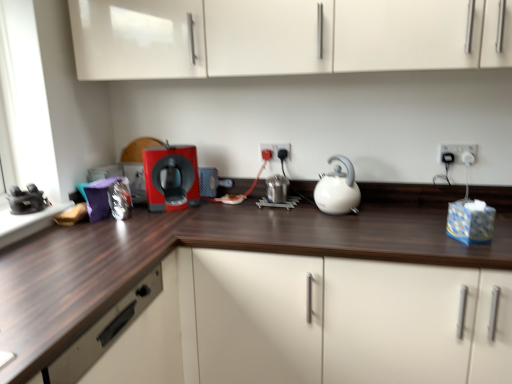
At what (x,y) coordinates should I click in order to perform the action: click on wooden drawer at lower left. Please return your answer as a coordinate pair (x, y). Looking at the image, I should click on (104, 332).

What do you see at coordinates (277, 149) in the screenshot?
I see `matte plastic plug at center, arranged as the first electric outlet when viewed from the left` at bounding box center [277, 149].

This screenshot has height=384, width=512. Find the location of `white glossy kettle at center`. white glossy kettle at center is located at coordinates (338, 189).

At what (x,y) coordinates should I click in order to perform the action: click on matte plastic coffee machine at center. Please return your answer as a coordinate pair (x, y). This screenshot has height=384, width=512. Looking at the image, I should click on (170, 177).

From a real-world perspective, is dark wood countertop at center above or below matte plastic plug at center, the 1th electric outlet in the back-to-front sequence?

In terms of real-world spatial position, dark wood countertop at center is below matte plastic plug at center, the 1th electric outlet in the back-to-front sequence.

Does dark wood countertop at center come in front of matte plastic plug at center, arranged as the first electric outlet when viewed from the left?

Yes, dark wood countertop at center is in front of matte plastic plug at center, arranged as the first electric outlet when viewed from the left.

Between dark wood countertop at center and matte plastic plug at center, the second electric outlet in the right-to-left sequence, which one has more height?

dark wood countertop at center is taller.

Would you say dark wood countertop at center is to the left or to the right of matte plastic plug at center, the 1th electric outlet in the back-to-front sequence, in the picture?

From the image, it's evident that dark wood countertop at center is to the right of matte plastic plug at center, the 1th electric outlet in the back-to-front sequence.

From a real-world perspective, between white glossy kettle at center and matte plastic plug at center, the 1th electric outlet in the back-to-front sequence, who is vertically lower?

white glossy kettle at center is physically lower.

Considering the relative sizes of white glossy kettle at center and matte plastic plug at center, the second electric outlet in the right-to-left sequence, in the image provided, is white glossy kettle at center smaller than matte plastic plug at center, the second electric outlet in the right-to-left sequence,?

No.

Can you see white glossy kettle at center touching matte plastic plug at center, arranged as the second electric outlet when viewed from the front?

white glossy kettle at center is not next to matte plastic plug at center, arranged as the second electric outlet when viewed from the front, and they're not touching.

How different are the orientations of matte plastic plug at center, the 1th electric outlet in the back-to-front sequence, and matte plastic coffee machine at center in degrees?

matte plastic plug at center, the 1th electric outlet in the back-to-front sequence, and matte plastic coffee machine at center are facing 37.7 degrees away from each other.

Is matte plastic coffee machine at center completely or partially inside matte plastic plug at center, arranged as the second electric outlet when viewed from the front?

No, matte plastic plug at center, arranged as the second electric outlet when viewed from the front, does not contain matte plastic coffee machine at center.

Is point (278, 159) positioned before point (168, 209)?

No.

I want to click on home appliance that appears on the left of matte plastic plug at center, the 1th electric outlet in the back-to-front sequence, so click(x=170, y=177).

Is wooden drawer at lower left outside of white glossy kettle at center?

That's correct, wooden drawer at lower left is outside of white glossy kettle at center.

Is wooden drawer at lower left wider than white glossy kettle at center?

Indeed, wooden drawer at lower left has a greater width compared to white glossy kettle at center.

Is wooden drawer at lower left looking in the opposite direction of white glossy kettle at center?

No, wooden drawer at lower left is not facing the opposite direction of white glossy kettle at center.

In the image, is wooden drawer at lower left positioned in front of or behind white glossy kettle at center?

In the image, wooden drawer at lower left appears in front of white glossy kettle at center.

Would you say dark wood countertop at center is inside or outside white plastic electric outlet at upper right, the first electric outlet from the right?

dark wood countertop at center is not inside white plastic electric outlet at upper right, the first electric outlet from the right, it's outside.

From a real-world perspective, which object rests below the other?

dark wood countertop at center.

Considering the relative sizes of dark wood countertop at center and white plastic electric outlet at upper right, the first electric outlet from the right, in the image provided, is dark wood countertop at center bigger than white plastic electric outlet at upper right, the first electric outlet from the right,?

Yes.

Is point (15, 310) positioned behind point (467, 145)?

No.

Between point (450, 152) and point (71, 363), which one is positioned in front?

The point (71, 363) is closer to the camera.

Between white plastic electric outlet at upper right, which is the second electric outlet in left-to-right order, and wooden drawer at lower left, which one has smaller size?

white plastic electric outlet at upper right, which is the second electric outlet in left-to-right order.

From a real-world perspective, is white plastic electric outlet at upper right, which is the second electric outlet in left-to-right order, on top of wooden drawer at lower left?

Correct, in the physical world, white plastic electric outlet at upper right, which is the second electric outlet in left-to-right order, is higher than wooden drawer at lower left.

How many degrees apart are the facing directions of white plastic electric outlet at upper right, placed as the first electric outlet when sorted from front to back, and wooden drawer at lower left?

They differ by 91.2 degrees in their facing directions.

Is the surface of dark wood countertop at center in direct contact with wooden drawer at lower left?

dark wood countertop at center and wooden drawer at lower left are clearly separated.

From a real-world perspective, who is located lower, dark wood countertop at center or wooden drawer at lower left?

dark wood countertop at center.

Considering the relative sizes of dark wood countertop at center and wooden drawer at lower left in the image provided, is dark wood countertop at center shorter than wooden drawer at lower left?

In fact, dark wood countertop at center may be taller than wooden drawer at lower left.

Is dark wood countertop at center positioned with its back to wooden drawer at lower left?

dark wood countertop at center does not have its back to wooden drawer at lower left.

Locate an element on the screen. the 2nd electric outlet behind when counting from the dark wood countertop at center is located at coordinates (277, 149).

This screenshot has width=512, height=384. Identify the location of kitchen appliance on the right of matte plastic plug at center, the second electric outlet in the right-to-left sequence. (338, 189).

Looking at the image, which one is located further to white plastic electric outlet at upper right, the first electric outlet from the right, matte plastic coffee machine at center or dark wood countertop at center?

The object further to white plastic electric outlet at upper right, the first electric outlet from the right, is matte plastic coffee machine at center.

Considering their positions, is matte plastic plug at center, arranged as the second electric outlet when viewed from the front, positioned closer to dark wood countertop at center than white plastic electric outlet at upper right, placed as the first electric outlet when sorted from front to back?

matte plastic plug at center, arranged as the second electric outlet when viewed from the front, is positioned closer to the anchor dark wood countertop at center.

From the image, which object appears to be nearer to dark wood countertop at center, white glossy kettle at center or wooden drawer at lower left?

Based on the image, white glossy kettle at center appears to be nearer to dark wood countertop at center.

Considering their positions, is white plastic electric outlet at upper right, positioned as the 2th electric outlet in back-to-front order, positioned closer to matte plastic plug at center, arranged as the second electric outlet when viewed from the front, than wooden drawer at lower left?

white plastic electric outlet at upper right, positioned as the 2th electric outlet in back-to-front order, lies closer to matte plastic plug at center, arranged as the second electric outlet when viewed from the front, than the other object.

Estimate the real-world distances between objects in this image. Which object is closer to white glossy kettle at center, matte plastic coffee machine at center or dark wood countertop at center?

dark wood countertop at center is closer to white glossy kettle at center.

Estimate the real-world distances between objects in this image. Which object is further from matte plastic coffee machine at center, white plastic electric outlet at upper right, positioned as the 2th electric outlet in back-to-front order, or white glossy kettle at center?

Among the two, white plastic electric outlet at upper right, positioned as the 2th electric outlet in back-to-front order, is located further to matte plastic coffee machine at center.

Consider the image. Looking at the image, which one is located closer to white glossy kettle at center, white plastic electric outlet at upper right, positioned as the 2th electric outlet in back-to-front order, or matte plastic coffee machine at center?

The object closer to white glossy kettle at center is white plastic electric outlet at upper right, positioned as the 2th electric outlet in back-to-front order.

Looking at this image, based on their spatial positions, is wooden drawer at lower left or matte plastic plug at center, the 1th electric outlet in the back-to-front sequence, closer to matte plastic coffee machine at center?

matte plastic plug at center, the 1th electric outlet in the back-to-front sequence, is closer to matte plastic coffee machine at center.

Where is `kitchen appliance positioned between wooden drawer at lower left and matte plastic plug at center, the 1th electric outlet in the back-to-front sequence, from near to far`? This screenshot has height=384, width=512. kitchen appliance positioned between wooden drawer at lower left and matte plastic plug at center, the 1th electric outlet in the back-to-front sequence, from near to far is located at coordinates (338, 189).

At what (x,y) coordinates should I click in order to perform the action: click on electric outlet situated between matte plastic coffee machine at center and white glossy kettle at center from left to right. Please return your answer as a coordinate pair (x, y). This screenshot has width=512, height=384. Looking at the image, I should click on (277, 149).

This screenshot has height=384, width=512. In order to click on kitchen appliance located between matte plastic plug at center, the second electric outlet in the right-to-left sequence, and white plastic electric outlet at upper right, positioned as the 2th electric outlet in back-to-front order, in the left-right direction in this screenshot , I will do `click(338, 189)`.

Find the location of a particular element. The width and height of the screenshot is (512, 384). countertop situated between matte plastic coffee machine at center and white glossy kettle at center from left to right is located at coordinates (242, 249).